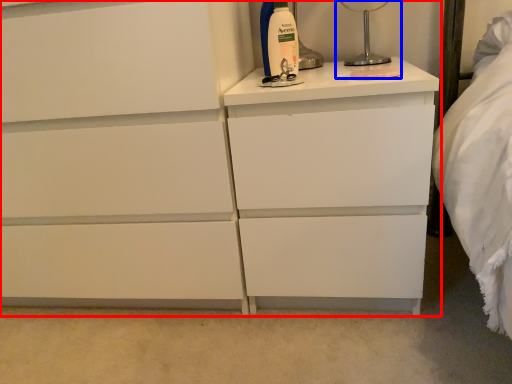
Question: Which of the following is the closest to the observer, chest of drawers (highlighted by a red box) or bedside lamp (highlighted by a blue box)?

Choices:
 (A) chest of drawers
 (B) bedside lamp

Answer: (A)